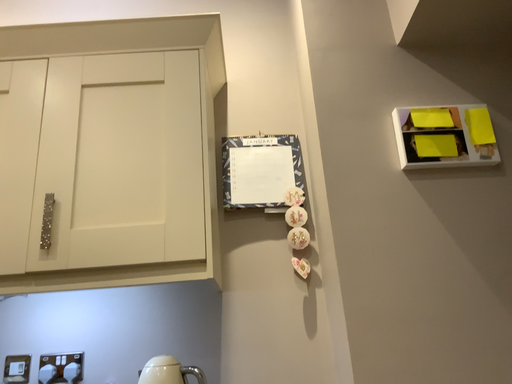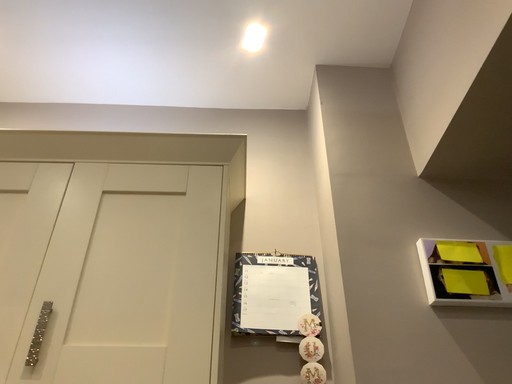
Question: How did the camera likely rotate when shooting the video?

Choices:
 (A) rotated downward
 (B) rotated upward

Answer: (B)